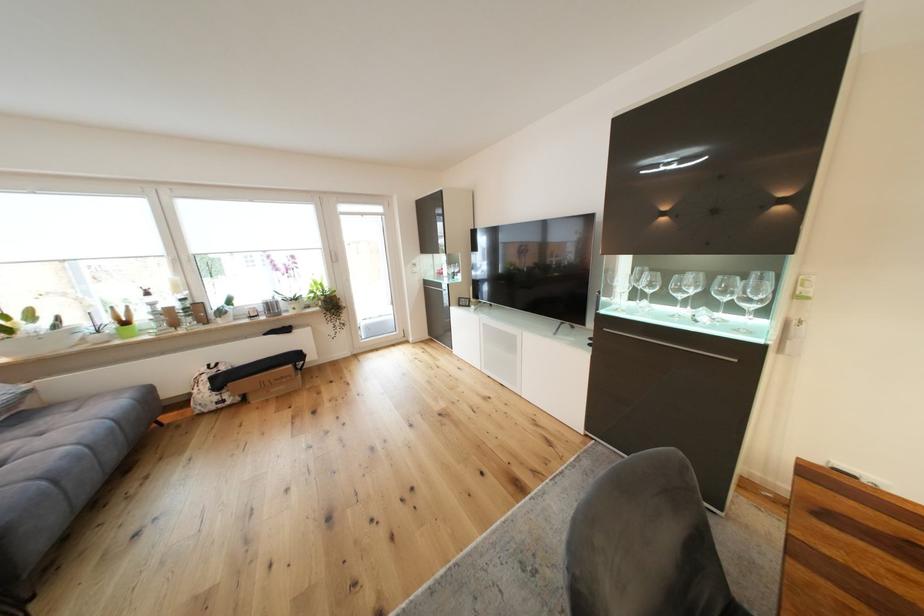
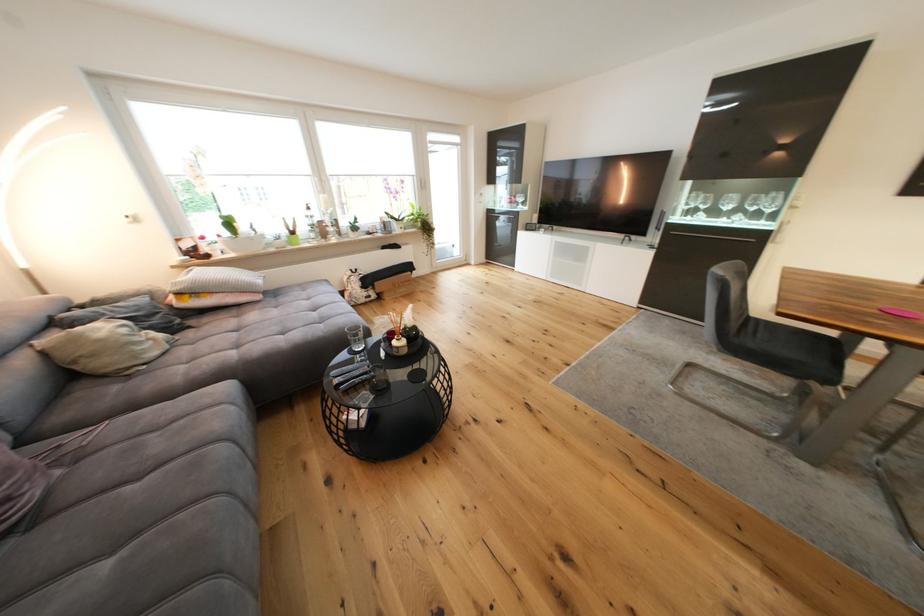
Question: I am providing you with two images of the same scene from different viewpoints. Please identify which objects are invisible in image2.

Choices:
 (A) black remote control
 (B) chair sitting surface
 (C) beige pillow
 (D) none of these

Answer: (D)